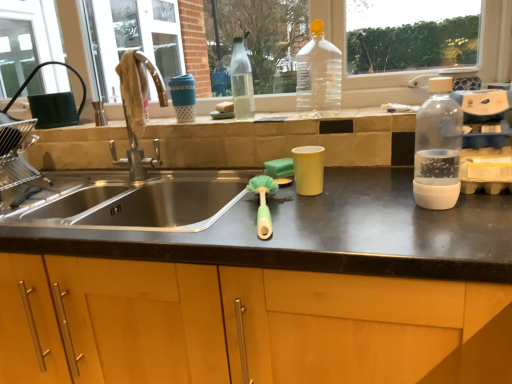
You are a GUI agent. You are given a task and a screenshot of the screen. Output one action in this format:
    pyautogui.click(x=<x>, y=<y>)
    Task: Click on the vacant space in between transparent plastic bottle at center, the 1th bottle positioned from the left, and transparent plastic bottle at upper center, arranged as the second bottle when viewed from the left
    
    Given the screenshot: What is the action you would take?
    pyautogui.click(x=273, y=117)